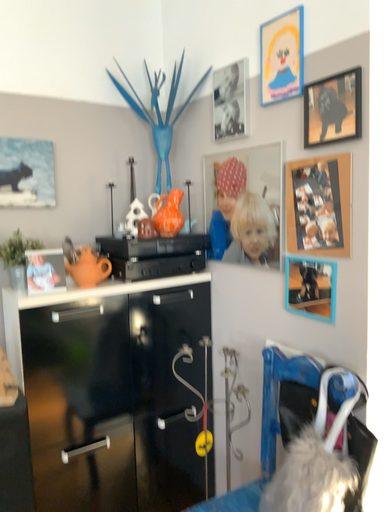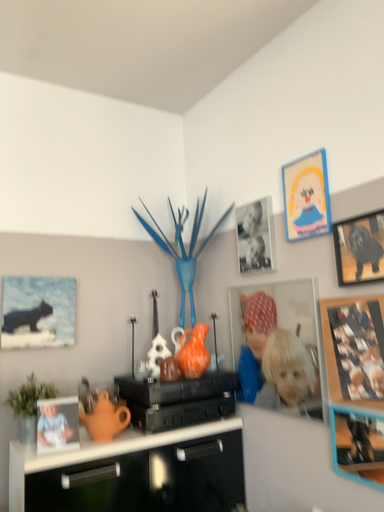
Question: How did the camera likely rotate when shooting the video?

Choices:
 (A) rotated downward
 (B) rotated upward

Answer: (B)